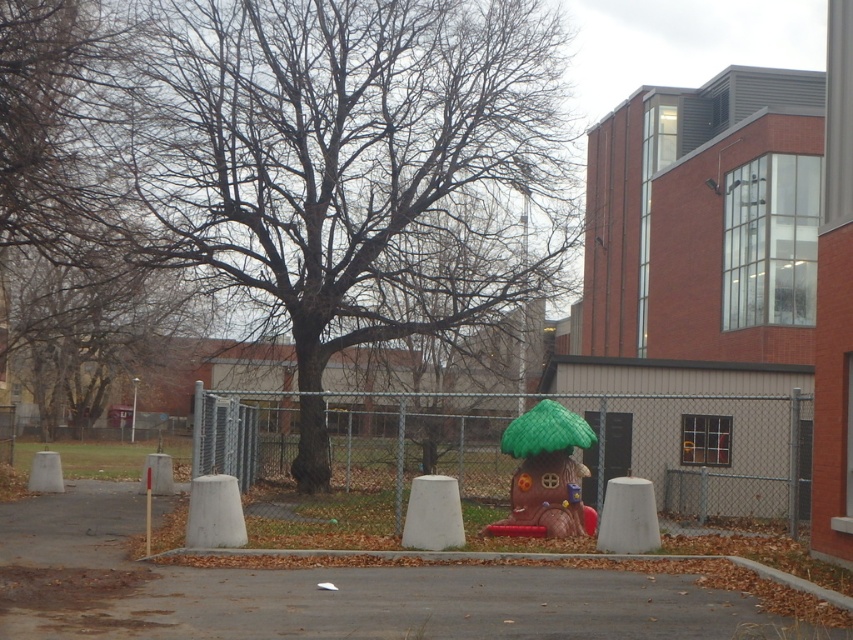
What is located at the point with coordinates (316, 589) in the image?

The gray asphalt pavement at center is located at point (316, 589).